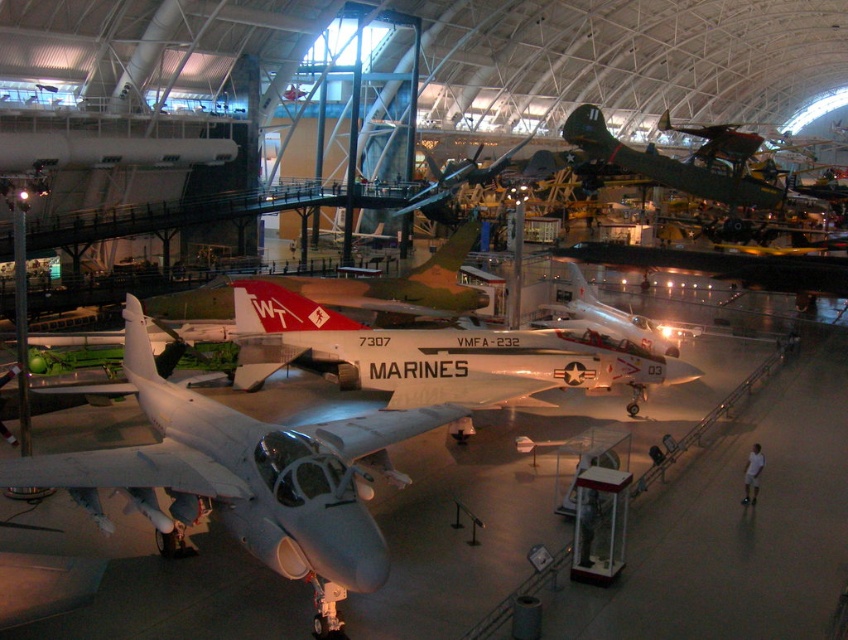
Between point (36, 476) and point (678, 355), which one is positioned behind?

The point (678, 355) is behind.

Is matte gray jet at center above silver metallic airplane at center?

No, matte gray jet at center is not above silver metallic airplane at center.

Is point (170, 472) closer to viewer compared to point (616, 316)?

Yes.

This screenshot has width=848, height=640. I want to click on matte gray jet at center, so click(244, 476).

Does white matte airplane at center have a larger size compared to green matte airplane at upper right?

No, white matte airplane at center is not bigger than green matte airplane at upper right.

Consider the image. Between white matte airplane at center and green matte airplane at upper right, which one appears on the right side from the viewer's perspective?

green matte airplane at upper right

Who is more distant from viewer, (616, 385) or (674, 164)?

The point (674, 164) is more distant.

The width and height of the screenshot is (848, 640). I want to click on white matte airplane at center, so click(430, 355).

Which is in front, point (338, 621) or point (757, 145)?

Point (338, 621) is more forward.

Is matte gray jet at center bigger than green matte airplane at upper right?

No.

Locate an element on the screen. The height and width of the screenshot is (640, 848). matte gray jet at center is located at coordinates 244,476.